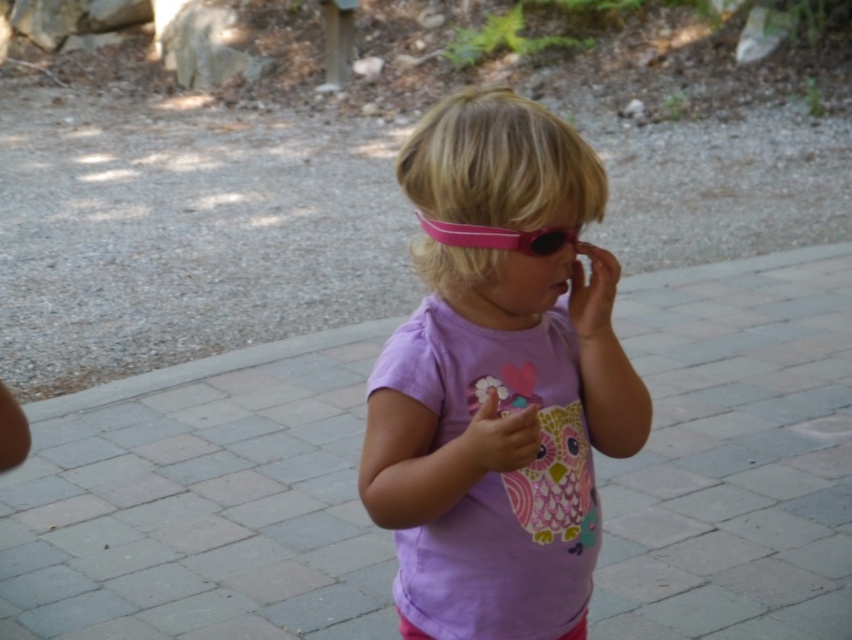
Does gray brick pavement at center have a lesser height compared to pink rubber goggles at center?

No, gray brick pavement at center is not shorter than pink rubber goggles at center.

How distant is gray brick pavement at center from pink rubber goggles at center?

gray brick pavement at center is 3.60 meters away from pink rubber goggles at center.

The image size is (852, 640). What do you see at coordinates (200, 502) in the screenshot?
I see `gray brick pavement at center` at bounding box center [200, 502].

Find the location of a particular element. The height and width of the screenshot is (640, 852). gray brick pavement at center is located at coordinates click(200, 502).

Is gray brick pavement at center thinner than purple matte shirt at center?

Incorrect, gray brick pavement at center's width is not less than purple matte shirt at center's.

Looking at this image, measure the distance from gray brick pavement at center to purple matte shirt at center.

gray brick pavement at center and purple matte shirt at center are 8.30 feet apart.

The width and height of the screenshot is (852, 640). Identify the location of gray brick pavement at center. (200, 502).

Does purple matte shirt at center lie in front of pink rubber goggles at center?

Yes, it is.

Is point (465, 458) positioned in front of point (458, 227)?

Yes.

Find the location of `purple matte shirt at center`. purple matte shirt at center is located at coordinates (499, 380).